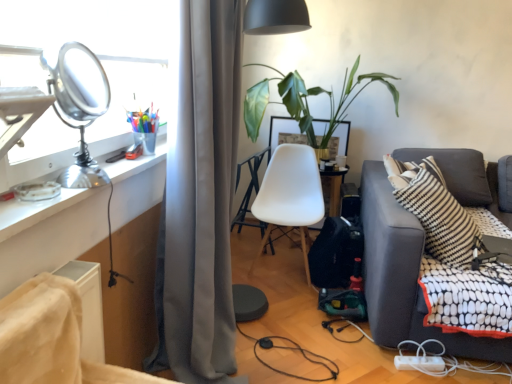
In order to face shiny metallic table lamp at upper left, should I rotate leftwards or rightwards?

Turn left by 22.039 degrees to look at shiny metallic table lamp at upper left.

What do you see at coordinates (435, 210) in the screenshot? The height and width of the screenshot is (384, 512). I see `black and white striped pillow at right` at bounding box center [435, 210].

Locate an element on the screen. The width and height of the screenshot is (512, 384). white plastic table at center is located at coordinates (249, 191).

Measure the distance between white plastic table at center and camera.

9.55 feet.

Describe the element at coordinates (200, 201) in the screenshot. I see `gray fabric curtain at center` at that location.

Locate an element on the screen. This screenshot has height=384, width=512. green leafy plant at center is located at coordinates (307, 101).

Where is `velvet-like beige chair at lower left, arranged as the first chair when viewed from the front`? velvet-like beige chair at lower left, arranged as the first chair when viewed from the front is located at coordinates (51, 338).

Looking at this image, is white plastic power strip at lower right next to metallic silver desk at left and touching it?

white plastic power strip at lower right and metallic silver desk at left are not in contact.

Locate an element on the screen. This screenshot has width=512, height=384. charge behind the metallic silver desk at left is located at coordinates 419,363.

Which is in front, point (424, 369) or point (138, 163)?

Positioned in front is point (138, 163).

From a real-world perspective, which object rests below the other?

In real-world perspective, white plastic power strip at lower right is lower.

Based on the photo, is metallic silver desk at left facing away from black and white striped pillow at right?

No, metallic silver desk at left's orientation is not away from black and white striped pillow at right.

Is metallic silver desk at left taller or shorter than black and white striped pillow at right?

Clearly, metallic silver desk at left is shorter compared to black and white striped pillow at right.

Consider the image. From a real-world perspective, is metallic silver desk at left physically above black and white striped pillow at right?

Yes, from a real-world perspective, metallic silver desk at left is above black and white striped pillow at right.

At what (x,y) coordinates should I click in order to perform the action: click on desk on the left of black and white striped pillow at right. Please return your answer as a coordinate pair (x, y). Looking at the image, I should click on (37, 210).

Can you see velvet-like beige chair at lower left, the 1th chair in the left-to-right sequence, touching dark gray fabric couch at right?

No, velvet-like beige chair at lower left, the 1th chair in the left-to-right sequence, is not with dark gray fabric couch at right.

Is velvet-like beige chair at lower left, marked as the second chair in a right-to-left arrangement, oriented towards dark gray fabric couch at right?

No.

From the image's perspective, between velvet-like beige chair at lower left, the 1th chair in the left-to-right sequence, and dark gray fabric couch at right, who is located below?

velvet-like beige chair at lower left, the 1th chair in the left-to-right sequence, from the image's perspective.

Is white plastic chair at center, the 2th chair positioned from the front, situated inside velvet-like beige chair at lower left, marked as the second chair in a right-to-left arrangement, or outside?

white plastic chair at center, the 2th chair positioned from the front, is located beyond the bounds of velvet-like beige chair at lower left, marked as the second chair in a right-to-left arrangement.

Can you confirm if white plastic chair at center, which is the 1th chair in right-to-left order, is positioned to the right of velvet-like beige chair at lower left, the second chair positioned from the back?

Yes, white plastic chair at center, which is the 1th chair in right-to-left order, is to the right of velvet-like beige chair at lower left, the second chair positioned from the back.

From the image's perspective, would you say white plastic chair at center, which appears as the second chair when viewed from the left, is shown under velvet-like beige chair at lower left, marked as the second chair in a right-to-left arrangement?

No, from the image's perspective, white plastic chair at center, which appears as the second chair when viewed from the left, is not below velvet-like beige chair at lower left, marked as the second chair in a right-to-left arrangement.

Can you tell me how much white plastic chair at center, which appears as the second chair when viewed from the left, and velvet-like beige chair at lower left, the second chair positioned from the back, differ in facing direction?

They differ by 87.4 degrees in their facing directions.

Considering the relative positions of shiny metallic table lamp at upper left and green leafy plant at center in the image provided, is shiny metallic table lamp at upper left to the left of green leafy plant at center from the viewer's perspective?

Yes.

Is point (96, 96) closer or farther from the camera than point (347, 103)?

Point (96, 96) is closer to the camera than point (347, 103).

Considering the sizes of shiny metallic table lamp at upper left and green leafy plant at center in the image, is shiny metallic table lamp at upper left taller or shorter than green leafy plant at center?

shiny metallic table lamp at upper left is shorter than green leafy plant at center.

Where is `table lamp that is above the green leafy plant at center (from a real-world perspective)`? table lamp that is above the green leafy plant at center (from a real-world perspective) is located at coordinates (80, 106).

Would you consider dark gray fabric couch at right to be distant from shiny metallic table lamp at upper left?

dark gray fabric couch at right is far away from shiny metallic table lamp at upper left.

Between dark gray fabric couch at right and shiny metallic table lamp at upper left, which one has smaller width?

Thinner between the two is shiny metallic table lamp at upper left.

Is dark gray fabric couch at right to the left of shiny metallic table lamp at upper left from the viewer's perspective?

No, dark gray fabric couch at right is not to the left of shiny metallic table lamp at upper left.

From a real-world perspective, is dark gray fabric couch at right located higher than shiny metallic table lamp at upper left?

No, from a real-world perspective, dark gray fabric couch at right is not above shiny metallic table lamp at upper left.

From the picture: How distant is dark gray fabric couch at right from white plastic chair at center, the 2th chair positioned from the front?

A distance of 56.67 centimeters exists between dark gray fabric couch at right and white plastic chair at center, the 2th chair positioned from the front.

I want to click on the 1st chair counting from the left of the dark gray fabric couch at right, so click(x=290, y=193).

Considering the relative sizes of dark gray fabric couch at right and white plastic chair at center, the first chair when ordered from back to front, in the image provided, is dark gray fabric couch at right thinner than white plastic chair at center, the first chair when ordered from back to front,?

No, dark gray fabric couch at right is not thinner than white plastic chair at center, the first chair when ordered from back to front.

Considering the relative positions of dark gray fabric couch at right and white plastic chair at center, the first chair when ordered from back to front, in the image provided, is dark gray fabric couch at right to the right of white plastic chair at center, the first chair when ordered from back to front, from the viewer's perspective?

Correct, you'll find dark gray fabric couch at right to the right of white plastic chair at center, the first chair when ordered from back to front.

Where is `desk in front of the white plastic power strip at lower right`? The height and width of the screenshot is (384, 512). desk in front of the white plastic power strip at lower right is located at coordinates (37, 210).

The height and width of the screenshot is (384, 512). In order to click on pillow on the right side of metallic silver desk at left in this screenshot , I will do `click(435, 210)`.

Considering their positions, is metallic silver desk at left positioned further to white plastic table at center than velvet-like beige chair at lower left, the second chair positioned from the back?

Based on the image, velvet-like beige chair at lower left, the second chair positioned from the back, appears to be further to white plastic table at center.

Which object lies further to the anchor point metallic silver desk at left, shiny metallic table lamp at upper left or dark gray fabric couch at right?

dark gray fabric couch at right.

Estimate the real-world distances between objects in this image. Which object is further from green leafy plant at center, white plastic table at center or metallic silver desk at left?

Based on the image, metallic silver desk at left appears to be further to green leafy plant at center.

Based on their spatial positions, is velvet-like beige chair at lower left, marked as the second chair in a right-to-left arrangement, or white plastic table at center further from dark gray fabric couch at right?

velvet-like beige chair at lower left, marked as the second chair in a right-to-left arrangement.

From the image, which object appears to be nearer to white plastic table at center, green leafy plant at center or white plastic power strip at lower right?

green leafy plant at center lies closer to white plastic table at center than the other object.

From the image, which object appears to be nearer to white plastic table at center, dark gray fabric couch at right or black and white striped pillow at right?

dark gray fabric couch at right is closer to white plastic table at center.

When comparing their distances from dark gray fabric couch at right, does white plastic table at center or white plastic power strip at lower right seem closer?

white plastic power strip at lower right is positioned closer to the anchor dark gray fabric couch at right.

Which object lies further to the anchor point metallic silver desk at left, green leafy plant at center or velvet-like beige chair at lower left, arranged as the first chair when viewed from the front?

green leafy plant at center lies further to metallic silver desk at left than the other object.

This screenshot has width=512, height=384. Identify the location of pillow located between velvet-like beige chair at lower left, the 1th chair in the left-to-right sequence, and green leafy plant at center in the depth direction. (435, 210).

Locate an element on the screen. This screenshot has width=512, height=384. curtain between velvet-like beige chair at lower left, arranged as the first chair when viewed from the front, and black and white striped pillow at right, along the z-axis is located at coordinates (200, 201).

This screenshot has height=384, width=512. Find the location of `curtain between shiny metallic table lamp at upper left and velvet-like beige chair at lower left, the 1th chair in the left-to-right sequence, from top to bottom`. curtain between shiny metallic table lamp at upper left and velvet-like beige chair at lower left, the 1th chair in the left-to-right sequence, from top to bottom is located at coordinates (200, 201).

Locate an element on the screen. This screenshot has height=384, width=512. table lamp located between metallic silver desk at left and gray fabric curtain at center in the left-right direction is located at coordinates (80, 106).